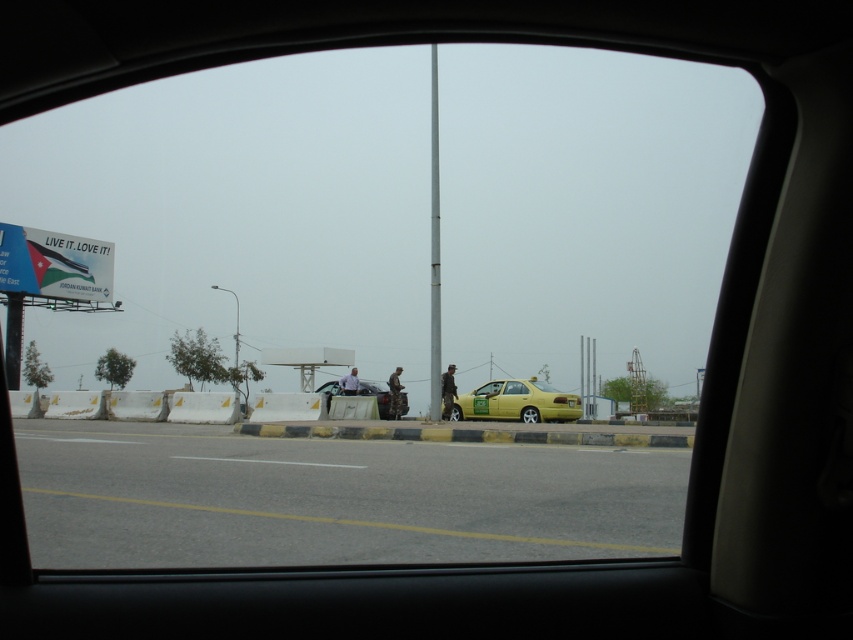
Who is more forward, (328, 384) or (351, 392)?

Point (351, 392) is more forward.

Does metallic silver car at center have a lesser width compared to light blue shirt at center?

In fact, metallic silver car at center might be wider than light blue shirt at center.

What do you see at coordinates (376, 396) in the screenshot?
I see `metallic silver car at center` at bounding box center [376, 396].

At what (x,y) coordinates should I click in order to perform the action: click on metallic silver car at center. Please return your answer as a coordinate pair (x, y). The image size is (853, 640). Looking at the image, I should click on (376, 396).

Does metallic silver car at center have a lesser height compared to camouflage fabric jacket at center?

Yes.

Who is lower down, metallic silver car at center or camouflage fabric jacket at center?

metallic silver car at center is below.

Image resolution: width=853 pixels, height=640 pixels. Find the location of `metallic silver car at center`. metallic silver car at center is located at coordinates (376, 396).

Who is lower down, metallic silver car at center or dark brown leather jacket at center?

Positioned lower is metallic silver car at center.

Identify the location of metallic silver car at center. The height and width of the screenshot is (640, 853). (376, 396).